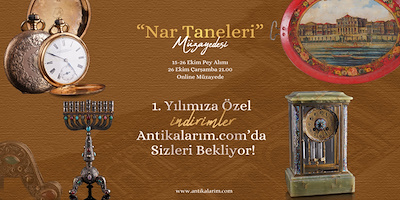
Identify the location of clock face. coord(320,125).